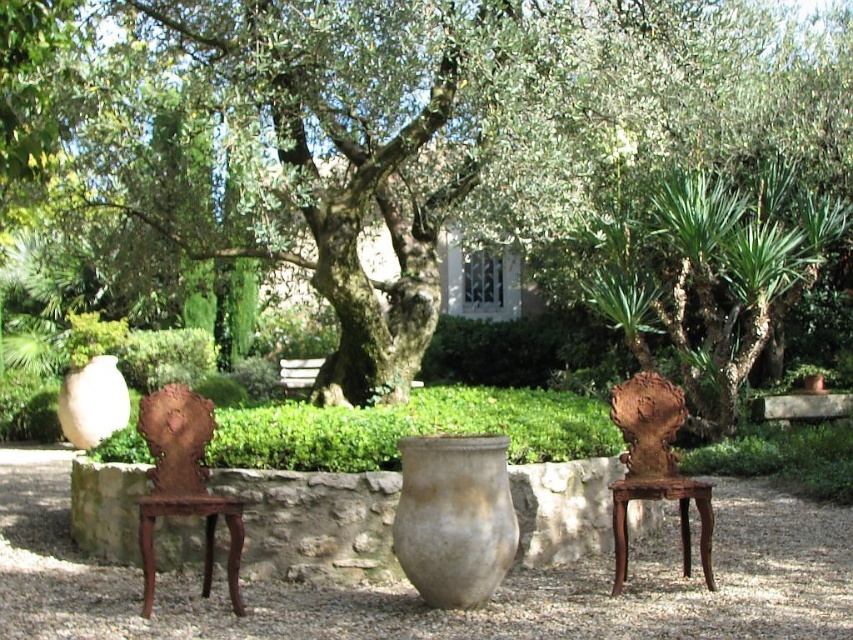
You are a gardener planning to place a new plant in this garden scene. You have a small plant that needs to be placed either on the matte gray vase at center or next to the rusty wood chair at left. Based on their positions, where should you place it to ensure the plant is elevated?

The matte gray vase at center is above the rusty wood chair at left, so placing the plant on the matte gray vase at center will elevate it.

Based on the photo, you are standing at the center of the gravel path in the garden. You need to move to the rusty wood chair at left. Which direction should you move to reach it?

Since the rusty wood chair at left is located at point 0.756 on the x and 0.216 on the y coordinate, you should move to the left and slightly forward to reach it.

You are standing in the garden and want to place a small potted plant between the rusty wood chair at left and the rusty metal sculpture at right. Based on their positions, which object should the potted plant be closer to if it needs to be placed at a lower elevation?

The potted plant should be placed closer to the rusty wood chair at left because it is positioned below the rusty metal sculpture at right, making the area near the chair lower in elevation.